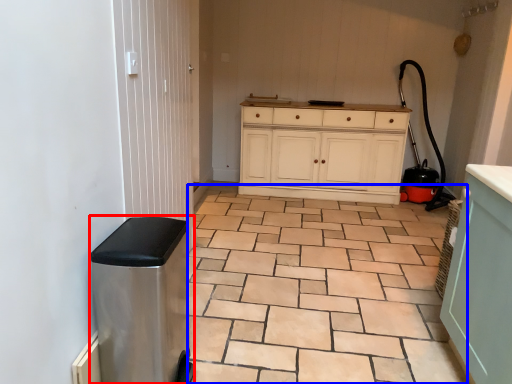
Question: Which of the following is the closest to the observer, water heater (highlighted by a red box) or ceramic tile (highlighted by a blue box)?

Choices:
 (A) water heater
 (B) ceramic tile

Answer: (A)